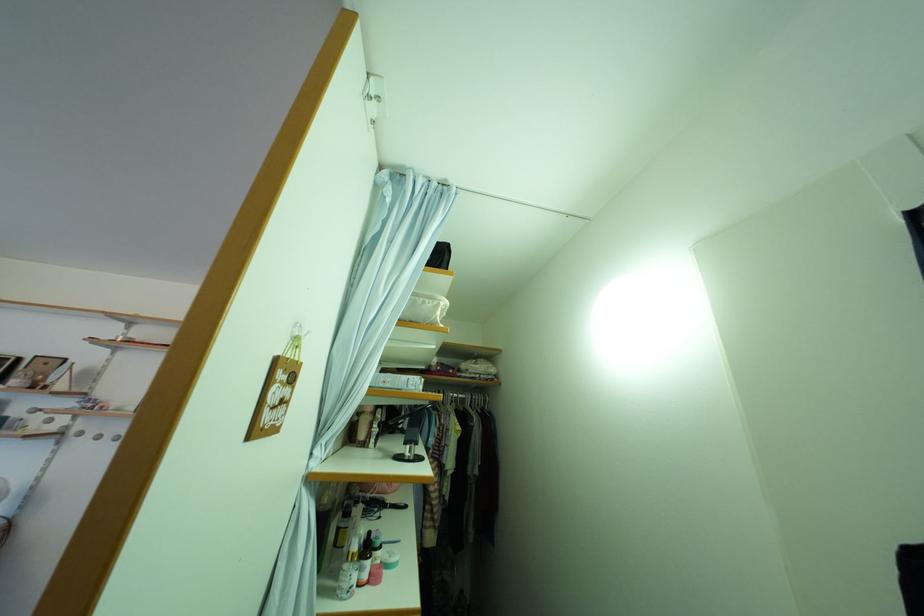
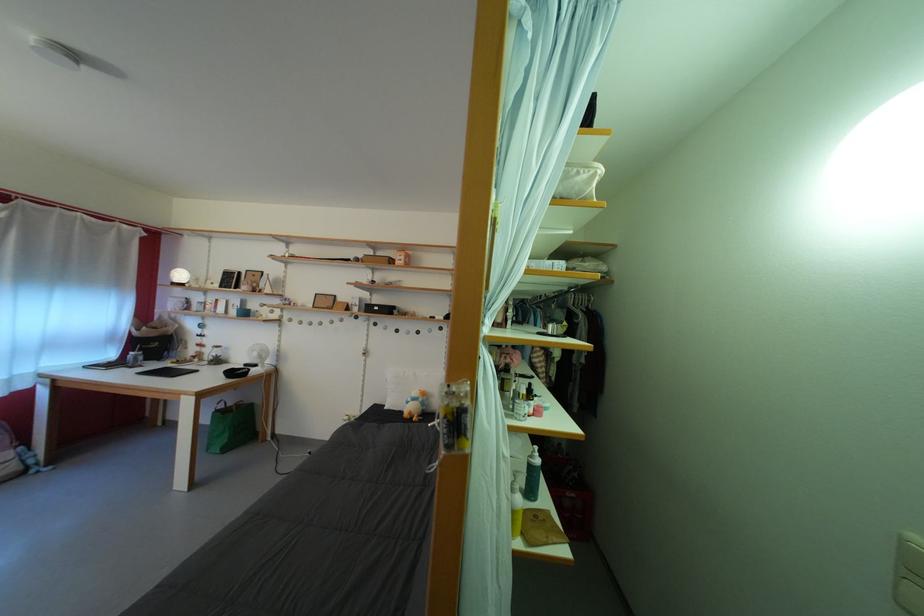
Find the pixel in the second image that matches (x=432, y=309) in the first image.

(587, 179)